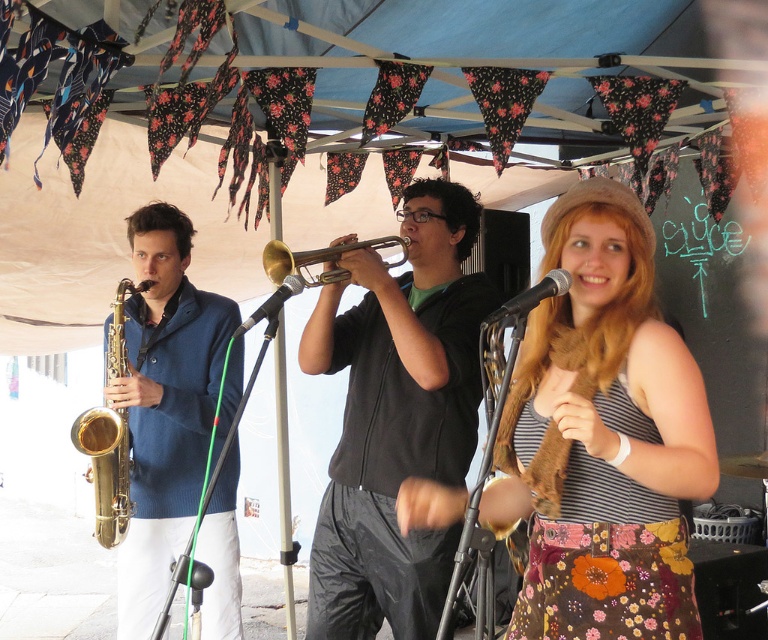
Which is in front, point (624, 589) or point (141, 493)?

Positioned in front is point (624, 589).

Is floral-patterned dress at center positioned at the back of gold shiny saxophone at left?

That is False.

Is point (588, 573) less distant than point (131, 324)?

Yes, it is in front of point (131, 324).

The height and width of the screenshot is (640, 768). What are the coordinates of `floral-patterned dress at center` in the screenshot? It's located at (601, 436).

Between point (458, 182) and point (78, 445), which one is positioned in front?

Point (458, 182) is more forward.

Is black matte trumpet at center taller than gold brass saxophone at left?

Correct, black matte trumpet at center is much taller as gold brass saxophone at left.

Identify the location of black matte trumpet at center. (396, 417).

Is gold brass saxophone at left above gold brass trumpet at center?

Actually, gold brass saxophone at left is below gold brass trumpet at center.

Is gold brass saxophone at left further to the viewer compared to gold brass trumpet at center?

Yes, gold brass saxophone at left is further from the viewer.

Between point (111, 442) and point (277, 280), which one is positioned in front?

Point (277, 280)

Identify the location of gold brass saxophone at left. This screenshot has width=768, height=640. click(106, 468).